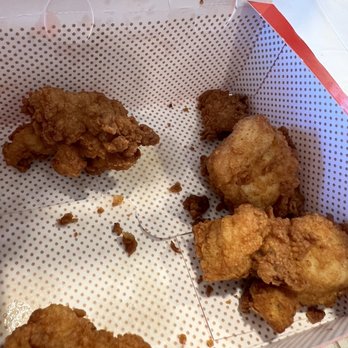
The height and width of the screenshot is (348, 348). In order to click on box in this screenshot , I will do `click(123, 10)`, `click(331, 185)`, `click(131, 287)`, `click(314, 338)`.